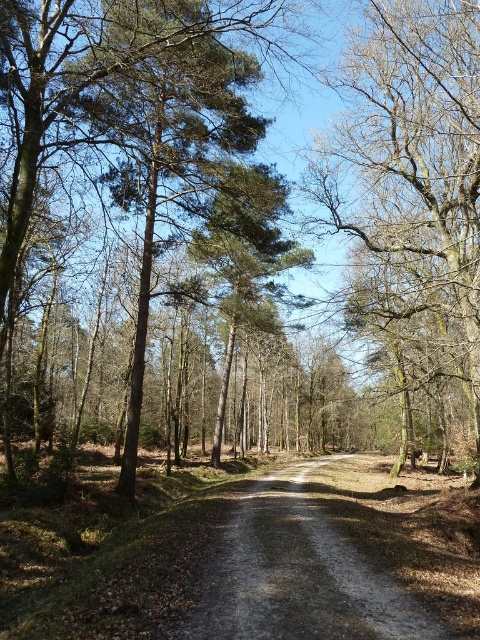
Is bare wood tree at center smaller than dirt/gravel trail at center?

Actually, bare wood tree at center might be larger than dirt/gravel trail at center.

Is bare wood tree at center shorter than dirt/gravel trail at center?

No.

Is point (351, 134) positioned before point (347, 572)?

No, it is not.

Where is `bare wood tree at center`? bare wood tree at center is located at coordinates (412, 156).